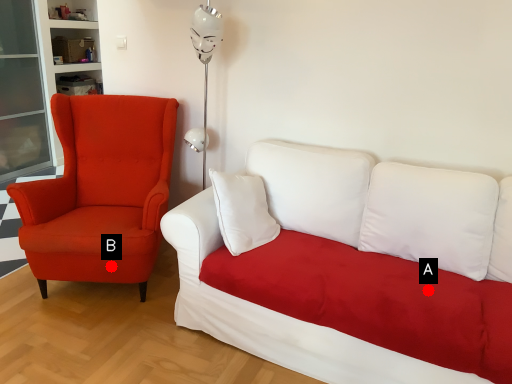
Question: Two points are circled on the image, labeled by A and B beside each circle. Which point is farther to the camera?

Choices:
 (A) A is further
 (B) B is further

Answer: (B)